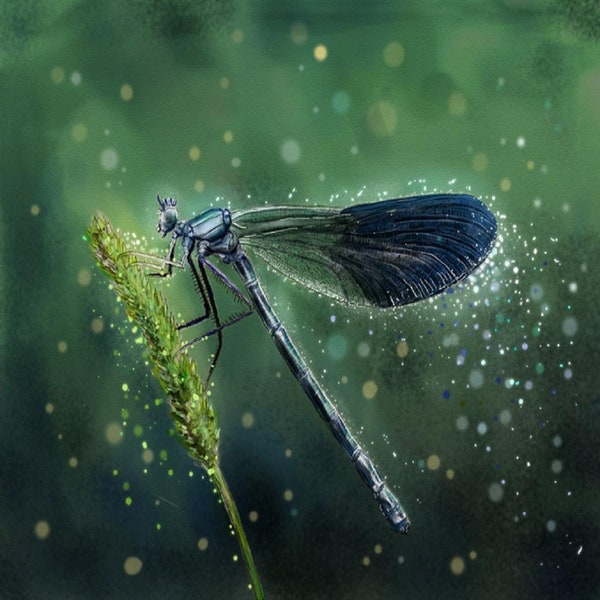
Image resolution: width=600 pixels, height=600 pixels. I want to click on plant, so click(x=153, y=330).